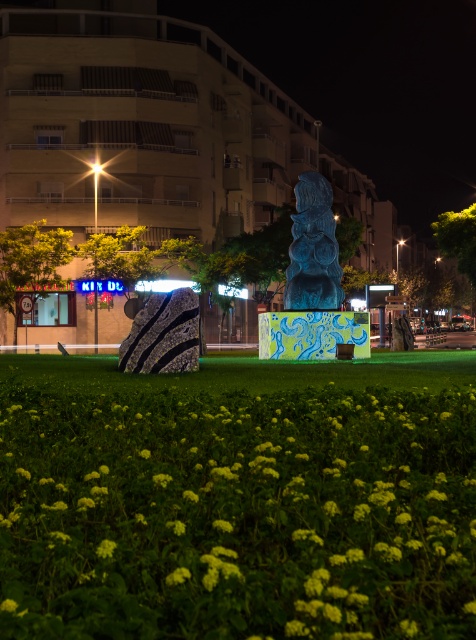
Is blue glossy statue at center taller than green matte flower at lower center?

Yes, blue glossy statue at center is taller than green matte flower at lower center.

Is blue glossy statue at center smaller than green matte flower at lower center?

No, blue glossy statue at center is not smaller than green matte flower at lower center.

At what (x,y) coordinates should I click in order to perform the action: click on blue glossy statue at center. Please return your answer as a coordinate pair (x, y). The width and height of the screenshot is (476, 640). Looking at the image, I should click on (313, 248).

Where is `blue glossy statue at center`? blue glossy statue at center is located at coordinates (313, 248).

In the scene shown: Can you confirm if yellow matte flowers at center is smaller than blue glossy statue at center?

Yes.

Does yellow matte flowers at center appear under blue glossy statue at center?

Indeed, yellow matte flowers at center is positioned under blue glossy statue at center.

What do you see at coordinates (237, 515) in the screenshot? The image size is (476, 640). I see `yellow matte flowers at center` at bounding box center [237, 515].

Find the location of a particular element. The height and width of the screenshot is (640, 476). yellow matte flowers at center is located at coordinates (237, 515).

You are a GUI agent. You are given a task and a screenshot of the screen. Output one action in this format:
    pyautogui.click(x=<x>, y=<y>)
    Task: Click on the yellow matte flowers at center
    The width and height of the screenshot is (476, 640).
    Given the screenshot: What is the action you would take?
    pyautogui.click(x=237, y=515)

From the picture: Can you confirm if yellow matte flowers at center is taller than green matte flower at lower center?

Yes.

Measure the distance between point (376, 582) and camera.

They are 2.24 meters apart.

At what (x,y) coordinates should I click in order to perform the action: click on yellow matte flowers at center. Please return your answer as a coordinate pair (x, y). Image resolution: width=476 pixels, height=640 pixels. Looking at the image, I should click on (237, 515).